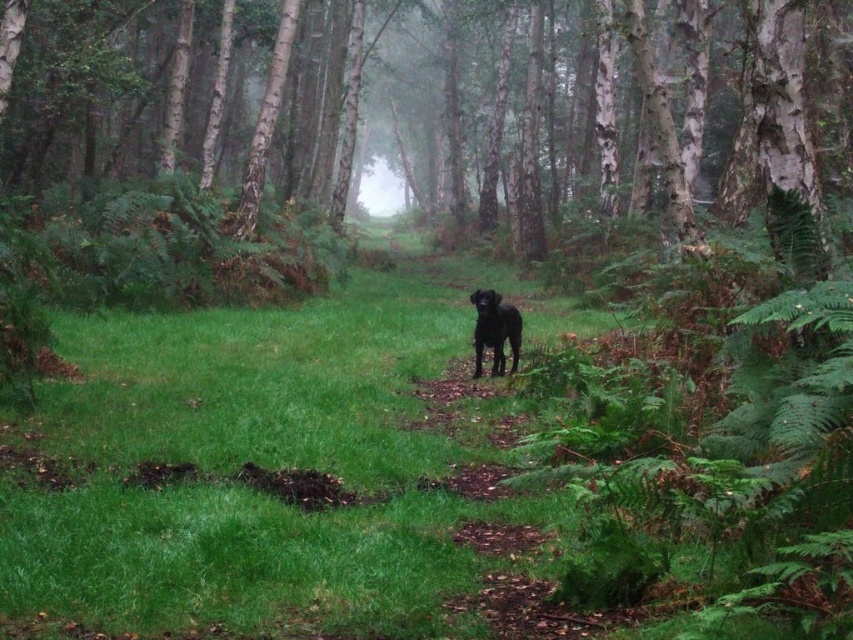
You are a hiker who wants to take a photo of the green grass at center and the smooth bark trees at center. Which object should you focus on first if you want both to be in sharp focus?

The green grass at center is smaller than the smooth bark trees at center, so you should focus on the smooth bark trees at center first to ensure both are in sharp focus.

You are a hiker who just arrived at the forest. You see the green grass at center and the shiny black dog at center. Which object is closer to the ground?

The green grass at center is positioned under the shiny black dog at center, so the green grass at center is closer to the ground.

You are a hiker who wants to walk on the green grass at center without stepping on the shiny black dog at center. Which direction should you walk to avoid stepping on the dog?

The green grass at center is taller than the shiny black dog at center, so you should walk around the dog by moving to the sides of the dog where the grass is shorter, ensuring you don not step on it.